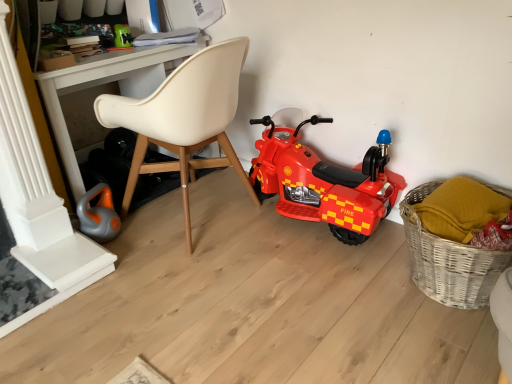
Identify the location of vacant area in front of beige leather chair at center. (195, 296).